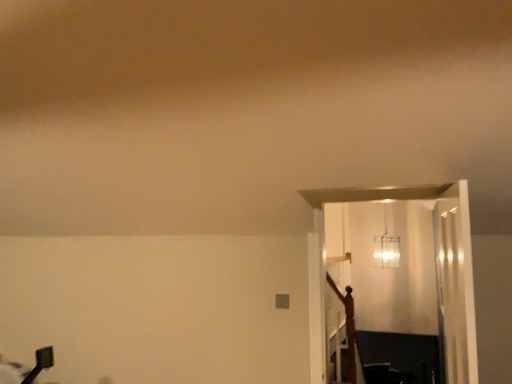
Describe the element at coordinates (455, 290) in the screenshot. This screenshot has height=384, width=512. I see `clear glass door at right` at that location.

In order to click on translucent glass pendant light at upper center in this screenshot , I will do `click(386, 248)`.

At what (x,y) coordinates should I click in order to perform the action: click on clear glass door at right. Please return your answer as a coordinate pair (x, y). The width and height of the screenshot is (512, 384). Looking at the image, I should click on (455, 290).

Between clear glass door at right and wooden crucifix at right, which one has larger size?

clear glass door at right is bigger.

Does clear glass door at right have a greater height compared to wooden crucifix at right?

No, clear glass door at right is not taller than wooden crucifix at right.

Looking at their sizes, would you say clear glass door at right is wider or thinner than wooden crucifix at right?

clear glass door at right is wider than wooden crucifix at right.

From the image's perspective, is clear glass door at right located above or below wooden crucifix at right?

Based on their image positions, clear glass door at right is located above wooden crucifix at right.

From the picture: How different are the orientations of wooden crucifix at right and clear glass door at right in degrees?

wooden crucifix at right and clear glass door at right are facing 84.2 degrees away from each other.

Where is `crucifix that appears behind the clear glass door at right`? The width and height of the screenshot is (512, 384). crucifix that appears behind the clear glass door at right is located at coordinates (347, 328).

How distant is wooden crucifix at right from clear glass door at right?

The distance of wooden crucifix at right from clear glass door at right is 95.72 centimeters.

Between wooden crucifix at right and clear glass door at right, which one has smaller width?

wooden crucifix at right.

Based on the photo, based on their sizes in the image, would you say translucent glass pendant light at upper center is bigger or smaller than wooden crucifix at right?

translucent glass pendant light at upper center is bigger than wooden crucifix at right.

Which is nearer, (384, 233) or (350, 294)?

Point (384, 233) is farther from the camera than point (350, 294).

From a real-world perspective, is translucent glass pendant light at upper center below wooden crucifix at right?

Actually, translucent glass pendant light at upper center is physically above wooden crucifix at right in the real world.

Is translucent glass pendant light at upper center oriented away from wooden crucifix at right?

translucent glass pendant light at upper center does not have its back to wooden crucifix at right.

Is translucent glass pendant light at upper center taller or shorter than clear glass door at right?

In the image, translucent glass pendant light at upper center appears to be shorter than clear glass door at right.

From the image's perspective, is translucent glass pendant light at upper center above or below clear glass door at right?

translucent glass pendant light at upper center is situated higher than clear glass door at right in the image.

Is translucent glass pendant light at upper center oriented away from clear glass door at right?

translucent glass pendant light at upper center does not have its back to clear glass door at right.

Considering the relative sizes of clear glass door at right and translucent glass pendant light at upper center in the image provided, is clear glass door at right thinner than translucent glass pendant light at upper center?

Indeed, clear glass door at right has a lesser width compared to translucent glass pendant light at upper center.

In the scene shown: Is clear glass door at right aimed at translucent glass pendant light at upper center?

No, clear glass door at right is not aimed at translucent glass pendant light at upper center.

How far apart are clear glass door at right and translucent glass pendant light at upper center?

A distance of 8.40 feet exists between clear glass door at right and translucent glass pendant light at upper center.

How different are the orientations of clear glass door at right and translucent glass pendant light at upper center in degrees?

They differ by 83.3 degrees in their facing directions.

Consider the image. Between wooden crucifix at right and translucent glass pendant light at upper center, which one has smaller size?

wooden crucifix at right.

Which is correct: wooden crucifix at right is inside translucent glass pendant light at upper center, or outside of it?

The correct answer is: outside.

Is wooden crucifix at right facing away from translucent glass pendant light at upper center?

No, wooden crucifix at right's orientation is not away from translucent glass pendant light at upper center.

Locate an element on the screen. The width and height of the screenshot is (512, 384). crucifix below the clear glass door at right (from the image's perspective) is located at coordinates (347, 328).

Identify the location of glass door on the right side of wooden crucifix at right. Image resolution: width=512 pixels, height=384 pixels. (455, 290).

Looking at the image, which one is located closer to translucent glass pendant light at upper center, wooden crucifix at right or clear glass door at right?

The object closer to translucent glass pendant light at upper center is wooden crucifix at right.

Consider the image. Looking at the image, which one is located closer to wooden crucifix at right, translucent glass pendant light at upper center or clear glass door at right?

clear glass door at right.

When comparing their distances from wooden crucifix at right, does clear glass door at right or translucent glass pendant light at upper center seem closer?

clear glass door at right is closer to wooden crucifix at right.

Considering their positions, is translucent glass pendant light at upper center positioned further to clear glass door at right than wooden crucifix at right?

translucent glass pendant light at upper center is positioned further to the anchor clear glass door at right.

From the image, which object appears to be farther from translucent glass pendant light at upper center, clear glass door at right or wooden crucifix at right?

clear glass door at right is positioned further to the anchor translucent glass pendant light at upper center.

Which object lies further to the anchor point clear glass door at right, wooden crucifix at right or translucent glass pendant light at upper center?

translucent glass pendant light at upper center lies further to clear glass door at right than the other object.

Where is `crucifix between clear glass door at right and translucent glass pendant light at upper center from front to back`? crucifix between clear glass door at right and translucent glass pendant light at upper center from front to back is located at coordinates (347, 328).